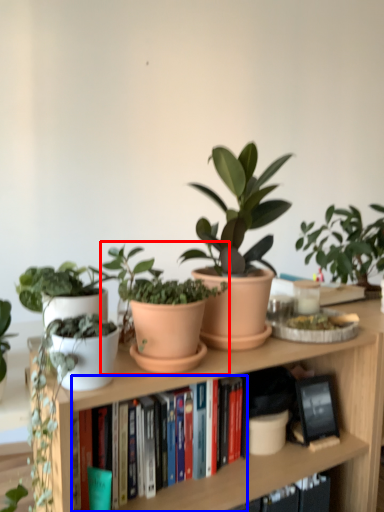
Question: Which of the following is the farthest to the observer, houseplant (highlighted by a red box) or book (highlighted by a blue box)?

Choices:
 (A) houseplant
 (B) book

Answer: (B)